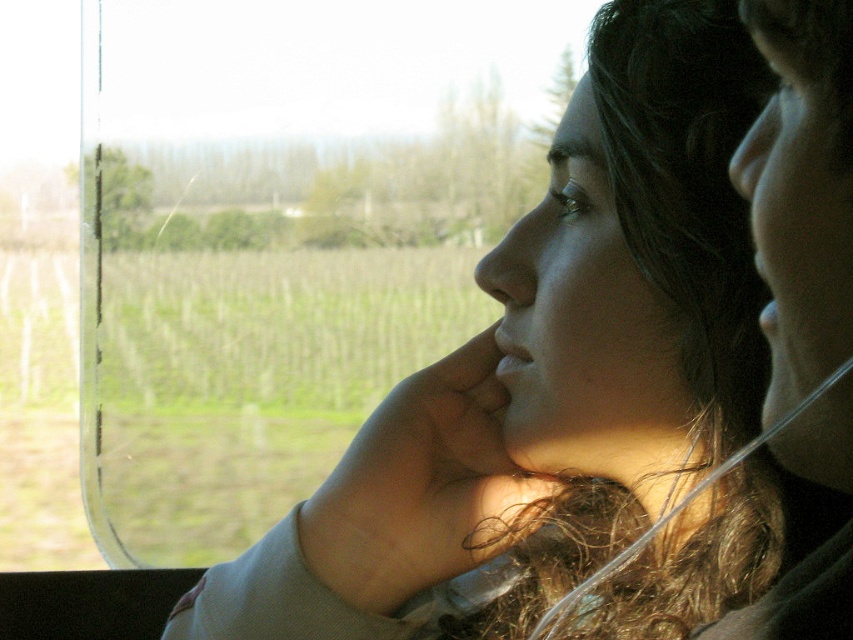
Question: Which point is closer to the camera?

Choices:
 (A) click(747, 136)
 (B) click(763, 422)

Answer: (A)

Question: Can you confirm if matte gray sweater at center is positioned to the right of matte skin nose at upper right?

Choices:
 (A) no
 (B) yes

Answer: (A)

Question: Does matte skin nose at center appear on the left side of matte skin nose at upper right?

Choices:
 (A) yes
 (B) no

Answer: (A)

Question: Among these points, which one is farthest from the camera?

Choices:
 (A) (843, 68)
 (B) (506, 289)

Answer: (B)

Question: Can you confirm if smooth skin face at right is positioned to the right of matte skin nose at center?

Choices:
 (A) yes
 (B) no

Answer: (A)

Question: Based on their relative distances, which object is farther from the matte skin nose at center?

Choices:
 (A) matte gray sweater at center
 (B) matte skin nose at upper right

Answer: (B)